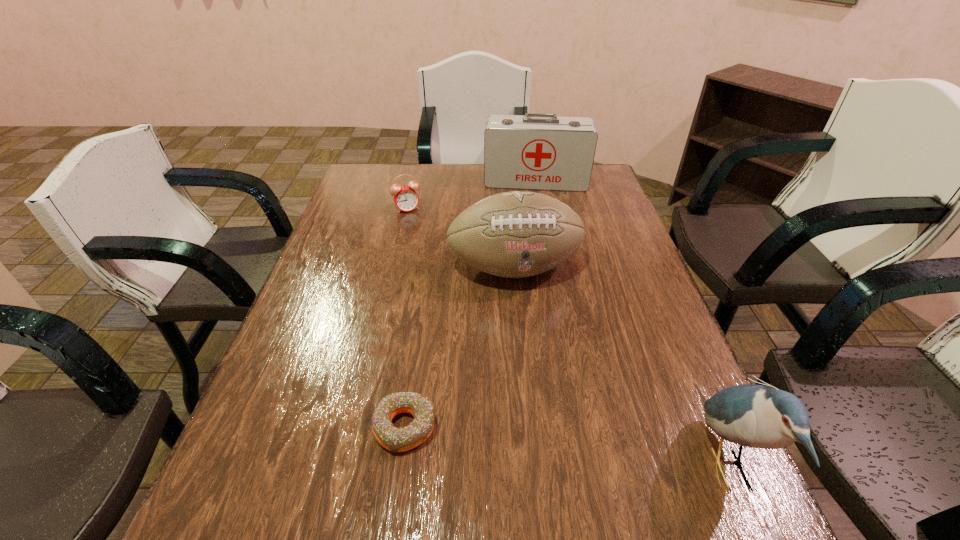
Image resolution: width=960 pixels, height=540 pixels. Find the location of `free location located 0.170m on the clock face of the fourth tallest object`. free location located 0.170m on the clock face of the fourth tallest object is located at coordinates (425, 244).

Where is `blank space located 0.390m on the clock face of the fourth tallest object`? The width and height of the screenshot is (960, 540). blank space located 0.390m on the clock face of the fourth tallest object is located at coordinates (448, 291).

The height and width of the screenshot is (540, 960). I want to click on vacant space situated 0.070m on the clock face of the fourth tallest object, so click(417, 225).

Locate an element on the screen. Image resolution: width=960 pixels, height=540 pixels. free space located 0.270m on the front-facing side of the farthest object is located at coordinates (534, 238).

Find the location of a particular element. Image resolution: width=960 pixels, height=540 pixels. vacant region located on the front-facing side of the farthest object is located at coordinates (534, 227).

Locate an element on the screen. The width and height of the screenshot is (960, 540). free space located on the front-facing side of the farthest object is located at coordinates (534, 236).

This screenshot has height=540, width=960. Identify the location of object that is positioned at the far edge. (533, 151).

Identify the location of doughnut located in the near edge section of the desktop. The image size is (960, 540). (395, 439).

Locate an element on the screen. Image resolution: width=960 pixels, height=540 pixels. bird present at the near edge is located at coordinates (759, 416).

I want to click on bird situated at the right edge, so click(x=759, y=416).